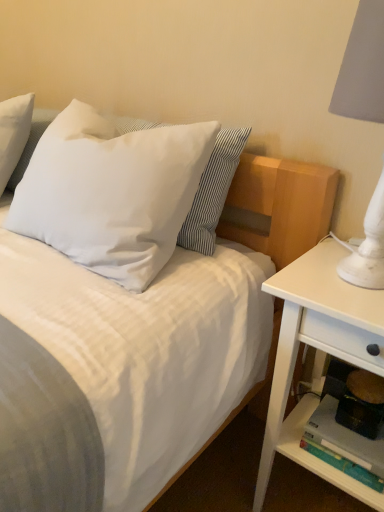
The height and width of the screenshot is (512, 384). I want to click on free space above white wood nightstand at right (from a real-world perspective), so click(x=334, y=274).